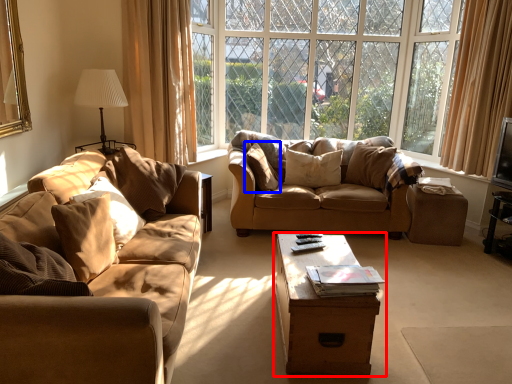
Question: Among these objects, which one is farthest to the camera, table (highlighted by a red box) or pillow (highlighted by a blue box)?

Choices:
 (A) table
 (B) pillow

Answer: (B)